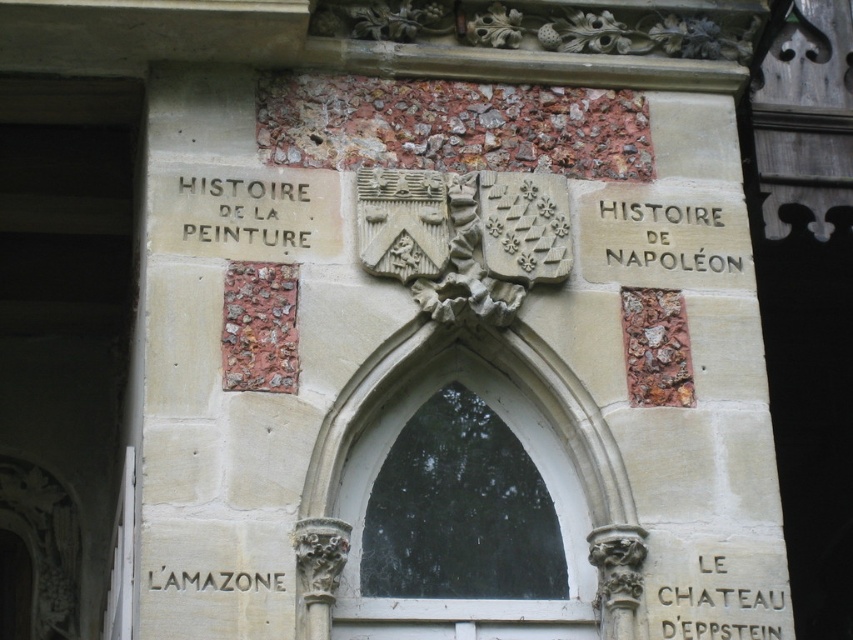
Who is taller, white stone text at upper center or white stone text at lower right?

Standing taller between the two is white stone text at upper center.

Between white stone text at upper center and white stone text at lower right, which one is positioned higher?

white stone text at upper center is higher up.

The width and height of the screenshot is (853, 640). I want to click on white stone text at upper center, so click(254, 212).

Consider the image. Who is higher up, smooth stone arch at center or white stone text at upper center?

white stone text at upper center is higher up.

Does smooth stone arch at center appear on the right side of white stone text at upper center?

Indeed, smooth stone arch at center is positioned on the right side of white stone text at upper center.

The height and width of the screenshot is (640, 853). Identify the location of smooth stone arch at center. (519, 448).

Is stone plaque at center to the left of matte stone l'amazone at lower center from the viewer's perspective?

In fact, stone plaque at center is to the right of matte stone l'amazone at lower center.

Measure the distance between stone plaque at center and matte stone l'amazone at lower center.

A distance of 38.58 feet exists between stone plaque at center and matte stone l'amazone at lower center.

Does point (668, 256) lie in front of point (250, 579)?

No.

Image resolution: width=853 pixels, height=640 pixels. Find the location of `stone plaque at center`. stone plaque at center is located at coordinates (664, 241).